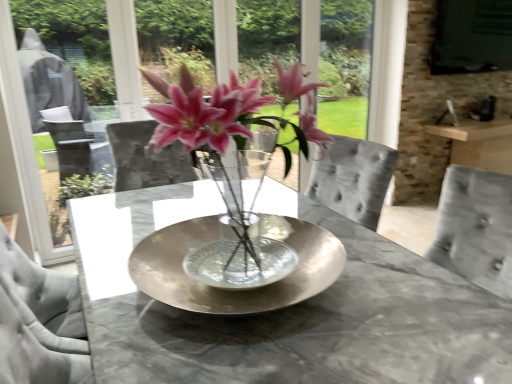
Measure the distance between point [182,378] and camera.

Point [182,378] and camera are 87.30 centimeters apart from each other.

Identify the location of metallic silver bowl at center. Image resolution: width=512 pixels, height=384 pixels. (318, 327).

The image size is (512, 384). I want to click on black matte window screen at upper right, so click(x=472, y=36).

Locate an element on the screen. The image size is (512, 384). table that is below the pink glass vase at center (from the image's perspective) is located at coordinates (318, 327).

Which object is thinner, metallic silver bowl at center or pink glass vase at center?

Thinner between the two is pink glass vase at center.

Are metallic silver bowl at center and pink glass vase at center far apart?

No, metallic silver bowl at center is not far away from pink glass vase at center.

From the image's perspective, who appears lower, metallic silver bowl at center or pink glass vase at center?

metallic silver bowl at center.

Considering the sizes of objects black matte window screen at upper right and metallic silver bowl at center in the image provided, who is bigger, black matte window screen at upper right or metallic silver bowl at center?

black matte window screen at upper right is bigger.

Between black matte window screen at upper right and metallic silver bowl at center, which one has larger width?

With larger width is metallic silver bowl at center.

Would you say black matte window screen at upper right is inside or outside metallic silver bowl at center?

black matte window screen at upper right is not inside metallic silver bowl at center, it's outside.

Is pink glass vase at center aimed at metallic silver bowl at center?

No, pink glass vase at center is not facing towards metallic silver bowl at center.

Which is in front, point (300, 130) or point (304, 339)?

Point (304, 339)

Measure the distance between pink glass vase at center and metallic silver bowl at center.

pink glass vase at center and metallic silver bowl at center are 14.83 inches apart.

Are pink glass vase at center and metallic silver bowl at center far apart?

pink glass vase at center is near metallic silver bowl at center, not far away.

Which of these two, metallic silver bowl at center or black matte window screen at upper right, stands shorter?

metallic silver bowl at center.

Which of these two, metallic silver bowl at center or black matte window screen at upper right, is wider?

With larger width is metallic silver bowl at center.

Which object is closer to the camera, metallic silver bowl at center or black matte window screen at upper right?

metallic silver bowl at center is more forward.

Where is `window screen lying on the right of metallic silver bowl at center`? This screenshot has width=512, height=384. window screen lying on the right of metallic silver bowl at center is located at coordinates (472, 36).

Considering the relative sizes of pink glass vase at center and black matte window screen at upper right in the image provided, is pink glass vase at center thinner than black matte window screen at upper right?

No.

Could you tell me if pink glass vase at center is turned towards black matte window screen at upper right?

No, pink glass vase at center is not turned towards black matte window screen at upper right.

From the image's perspective, is pink glass vase at center below black matte window screen at upper right?

Yes.

Which is farther, (x=297, y=75) or (x=481, y=27)?

The point (x=481, y=27) is farther.

How many degrees apart are the facing directions of black matte window screen at upper right and pink glass vase at center?

The angle between the facing direction of black matte window screen at upper right and the facing direction of pink glass vase at center is 91.1 degrees.

Image resolution: width=512 pixels, height=384 pixels. I want to click on window screen on the right of pink glass vase at center, so click(x=472, y=36).

Consider the image. Is black matte window screen at upper right wider or thinner than pink glass vase at center?

Considering their sizes, black matte window screen at upper right looks slimmer than pink glass vase at center.

Image resolution: width=512 pixels, height=384 pixels. Find the location of `table lying on the right of pink glass vase at center`. table lying on the right of pink glass vase at center is located at coordinates (318, 327).

There is a metallic silver bowl at center. At what (x,y) coordinates should I click in order to perform the action: click on window screen above it (from a real-world perspective). Please return your answer as a coordinate pair (x, y). Looking at the image, I should click on (472, 36).

Estimate the real-world distances between objects in this image. Which object is closer to black matte window screen at upper right, pink glass vase at center or metallic silver bowl at center?

pink glass vase at center lies closer to black matte window screen at upper right than the other object.

Which object lies further to the anchor point metallic silver bowl at center, black matte window screen at upper right or pink glass vase at center?

The object further to metallic silver bowl at center is black matte window screen at upper right.

Looking at the image, which one is located closer to pink glass vase at center, black matte window screen at upper right or metallic silver bowl at center?

Based on the image, metallic silver bowl at center appears to be nearer to pink glass vase at center.

When comparing their distances from metallic silver bowl at center, does pink glass vase at center or black matte window screen at upper right seem further?

black matte window screen at upper right.

When comparing their distances from black matte window screen at upper right, does metallic silver bowl at center or pink glass vase at center seem closer?

pink glass vase at center lies closer to black matte window screen at upper right than the other object.

Looking at the image, which one is located closer to pink glass vase at center, metallic silver bowl at center or black matte window screen at upper right?

The object closer to pink glass vase at center is metallic silver bowl at center.

This screenshot has height=384, width=512. I want to click on table located between pink glass vase at center and black matte window screen at upper right in the depth direction, so click(318, 327).